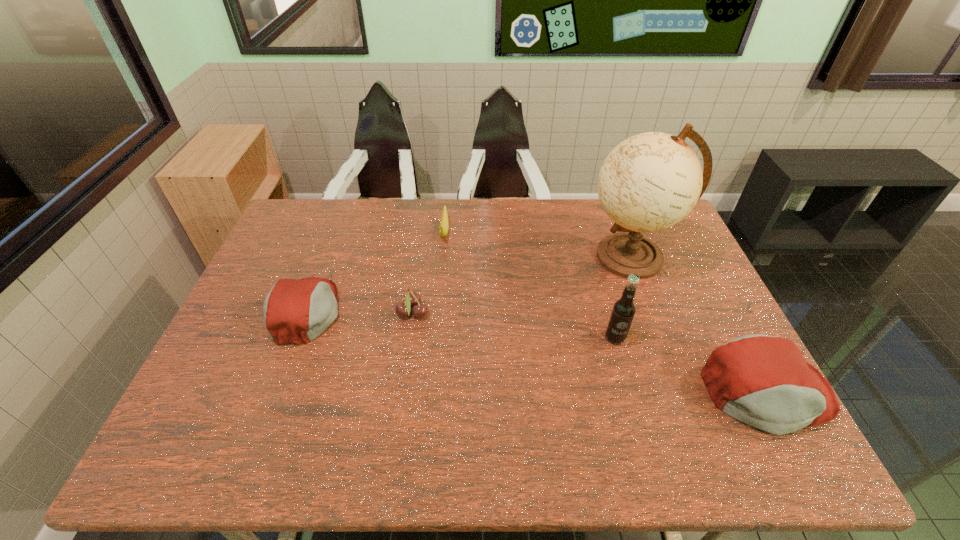
At what (x,y) coordinates should I click in order to perform the action: click on the left cap. Please return your answer as a coordinate pair (x, y). This screenshot has width=960, height=540. Looking at the image, I should click on (295, 311).

Image resolution: width=960 pixels, height=540 pixels. I want to click on the shorter cap, so click(295, 311).

Locate an element on the screen. This screenshot has width=960, height=540. the nearest object is located at coordinates (763, 381).

Image resolution: width=960 pixels, height=540 pixels. What are the coordinates of `the fourth shortest object` in the screenshot? It's located at [x=763, y=381].

I want to click on banana, so click(444, 223).

The image size is (960, 540). In order to click on the third object from left to right in this screenshot , I will do `click(444, 223)`.

The height and width of the screenshot is (540, 960). In order to click on the second object from left to right in this screenshot , I will do `click(412, 299)`.

This screenshot has height=540, width=960. Find the location of `the tallest object`. the tallest object is located at coordinates (651, 181).

Find the location of `root beer`. root beer is located at coordinates (623, 310).

What are the coordinates of `free space located on the front-facing side of the left cap` in the screenshot? It's located at (411, 312).